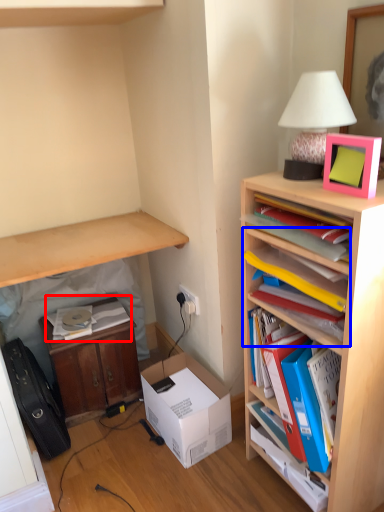
Question: Among these objects, which one is farthest to the camera, book (highlighted by a red box) or shelf (highlighted by a blue box)?

Choices:
 (A) book
 (B) shelf

Answer: (A)